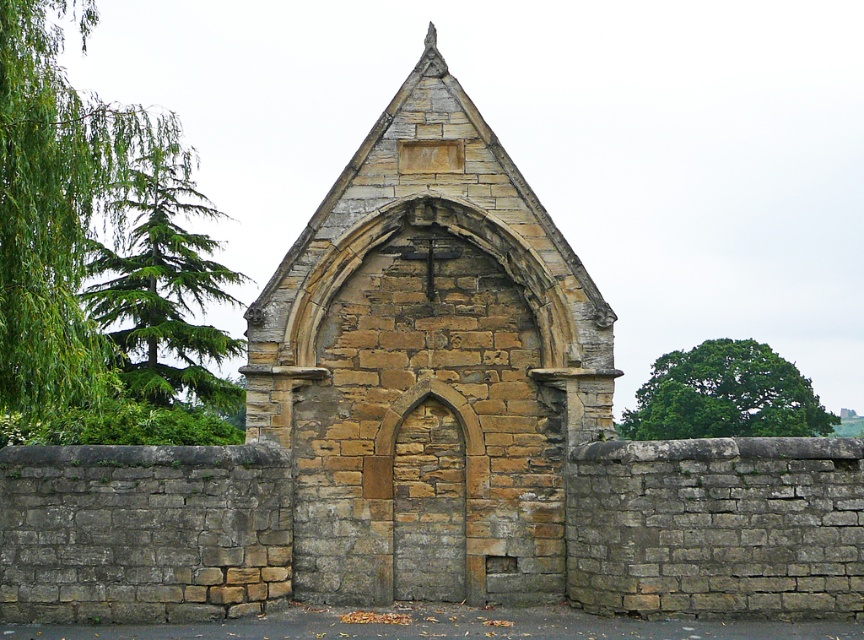
Question: Among these objects, which one is nearest to the camera?

Choices:
 (A) green needle-like leaves at left
 (B) yellow stone church at center
 (C) green leafy tree at upper right

Answer: (B)

Question: Which point is closer to the camera taking this photo?

Choices:
 (A) (337, 360)
 (B) (132, 320)
 (C) (650, 401)

Answer: (A)

Question: Is yellow stone church at center wider than green leafy tree at upper right?

Choices:
 (A) yes
 (B) no

Answer: (B)

Question: Considering the relative positions of yellow stone church at center and green needle-like leaves at left in the image provided, where is yellow stone church at center located with respect to green needle-like leaves at left?

Choices:
 (A) right
 (B) left

Answer: (A)

Question: Which point is farther from the camera taking this photo?

Choices:
 (A) 699,410
 (B) 144,244

Answer: (A)

Question: Does yellow stone church at center have a lesser width compared to green needle-like leaves at left?

Choices:
 (A) yes
 (B) no

Answer: (B)